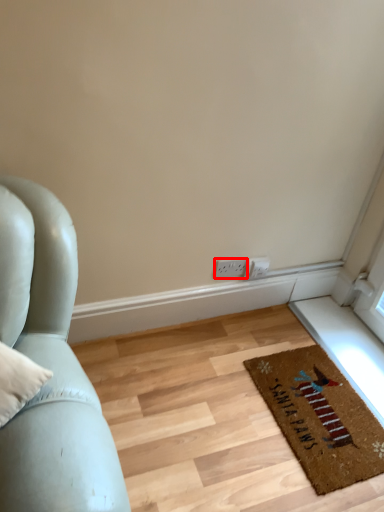
Question: Observing the image, what is the correct spatial positioning of electric outlet (annotated by the red box) in reference to mat?

Choices:
 (A) left
 (B) right

Answer: (A)